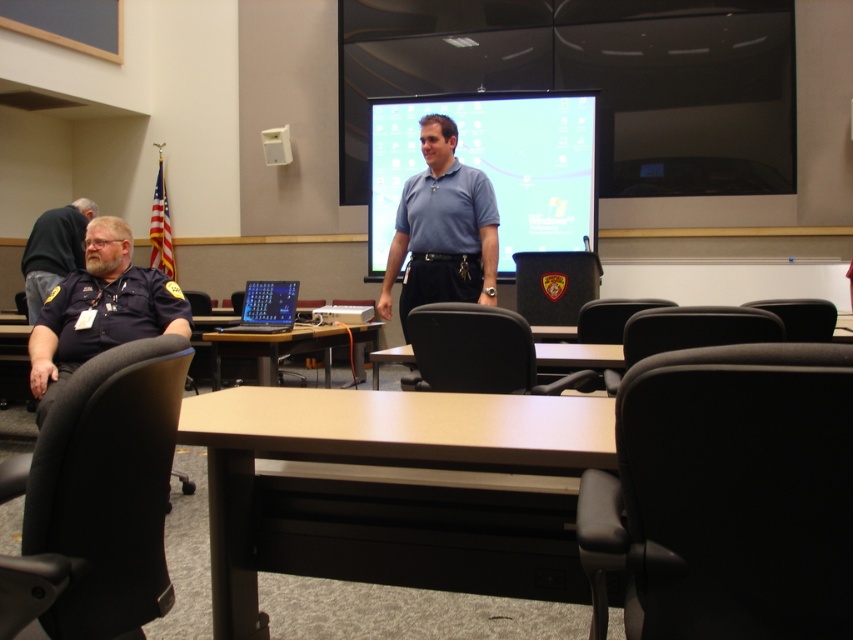
You are a guest entering the conference room and need to sit down. There is a matte blue screen at center and a black leather chair at center. Which object is closer to you as you enter the room?

The matte blue screen at center is closer to you because the black leather chair at center is behind it.

What are the coordinates of the brown wooden table at center?

The brown wooden table at center is located at point (283, 346).

You are sitting in the black leather chair at center and want to present a slide on the matte blue screen at center. Which direction should you turn your head to look at the screen?

The matte blue screen at center is positioned on the right side of the black leather chair at center, so you should turn your head to the right to look at the screen.